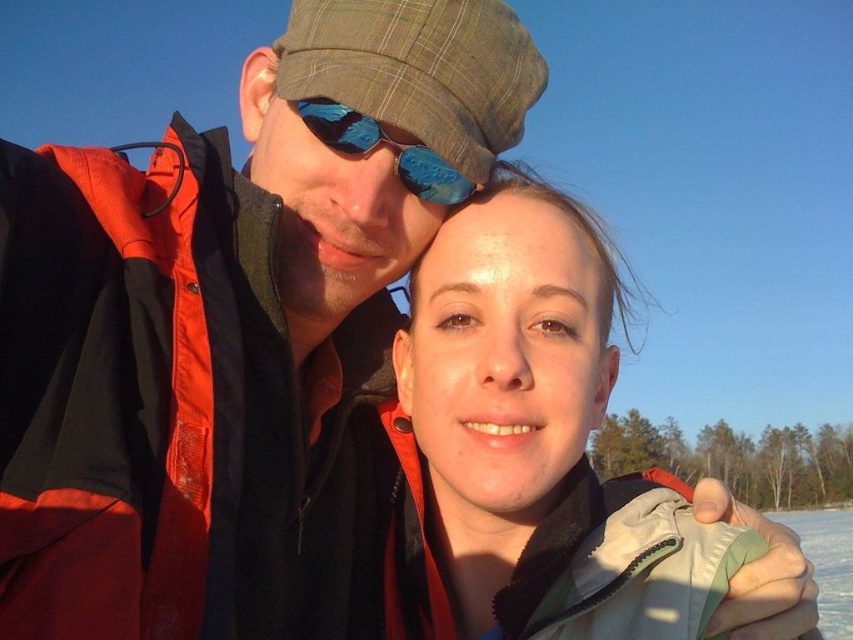
Question: Which point is farther to the camera?

Choices:
 (A) (440, 202)
 (B) (511, 512)

Answer: (A)

Question: Does matte black jacket at center appear over blue reflective lens at center?

Choices:
 (A) yes
 (B) no

Answer: (B)

Question: Among these points, which one is nearest to the camera?

Choices:
 (A) (479, 221)
 (B) (305, 109)

Answer: (B)

Question: Where is matte black jacket at center located in relation to blue reflective lens at center in the image?

Choices:
 (A) left
 (B) right

Answer: (B)

Question: Can you confirm if matte black jacket at center is thinner than blue reflective lens at center?

Choices:
 (A) yes
 (B) no

Answer: (B)